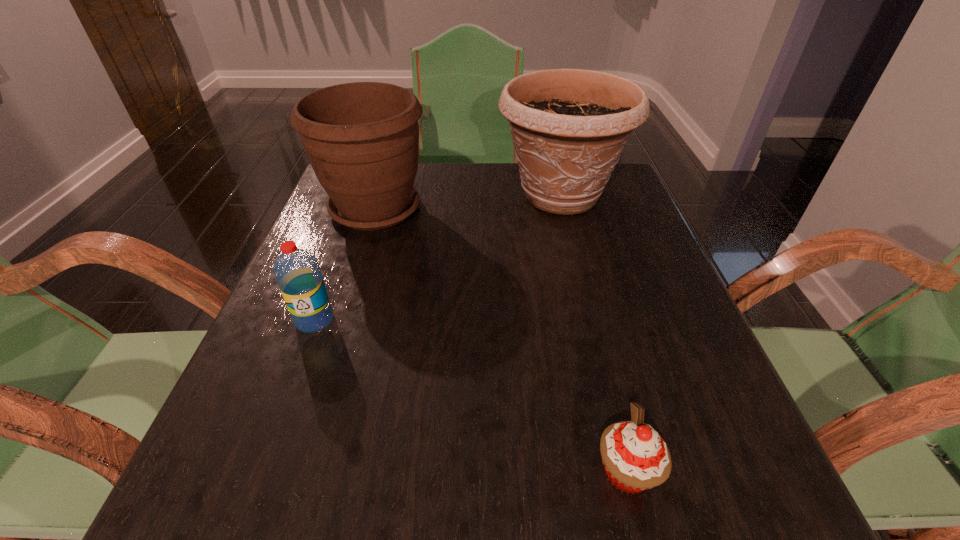
This screenshot has height=540, width=960. I want to click on the right flowerpot, so tap(569, 127).

At what (x,y) coordinates should I click in order to perform the action: click on the left flowerpot. Please return your answer as a coordinate pair (x, y). Looking at the image, I should click on 362,139.

Locate an element on the screen. The height and width of the screenshot is (540, 960). water bottle is located at coordinates (297, 272).

You are a GUI agent. You are given a task and a screenshot of the screen. Output one action in this format:
    pyautogui.click(x=<x>, y=<y>)
    Task: Click on the third farthest object
    This screenshot has height=540, width=960.
    Given the screenshot: What is the action you would take?
    pyautogui.click(x=297, y=272)

Where is `cupcake`? cupcake is located at coordinates (635, 457).

This screenshot has width=960, height=540. Find the location of `the nearest object`. the nearest object is located at coordinates click(635, 457).

The height and width of the screenshot is (540, 960). I want to click on free space located on the left of the right flowerpot, so click(399, 195).

The image size is (960, 540). In order to click on free location located on the front of the left flowerpot in this screenshot , I will do (317, 394).

In order to click on vacant space positioned 0.150m on the front label of the water bottle in this screenshot , I will do `click(280, 411)`.

The image size is (960, 540). I want to click on vacant space positioned 0.320m on the back of the nearest object, so click(x=581, y=285).